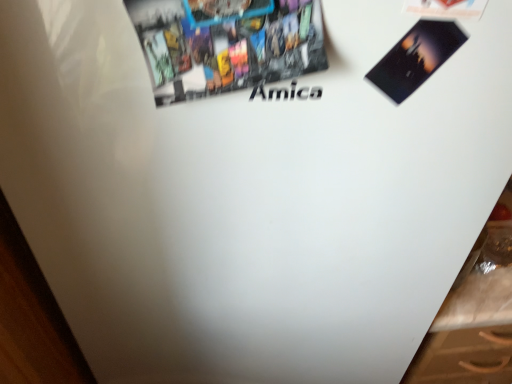
Question: From the image's perspective, is matte paper poster at upper center positioned above or below matte paper flyer at upper right?

Choices:
 (A) above
 (B) below

Answer: (B)

Question: Is matte paper poster at upper center bigger or smaller than matte paper flyer at upper right?

Choices:
 (A) small
 (B) big

Answer: (B)

Question: Is point (295, 36) closer or farther from the camera than point (394, 94)?

Choices:
 (A) closer
 (B) farther

Answer: (A)

Question: Is matte paper flyer at upper right bigger or smaller than matte paper poster at upper center?

Choices:
 (A) small
 (B) big

Answer: (A)

Question: From the image's perspective, is matte paper flyer at upper right located above or below matte paper poster at upper center?

Choices:
 (A) below
 (B) above

Answer: (B)

Question: Considering the positions of matte paper flyer at upper right and matte paper poster at upper center in the image, is matte paper flyer at upper right taller or shorter than matte paper poster at upper center?

Choices:
 (A) short
 (B) tall

Answer: (A)

Question: Would you say matte paper flyer at upper right is to the left or to the right of matte paper poster at upper center in the picture?

Choices:
 (A) right
 (B) left

Answer: (A)